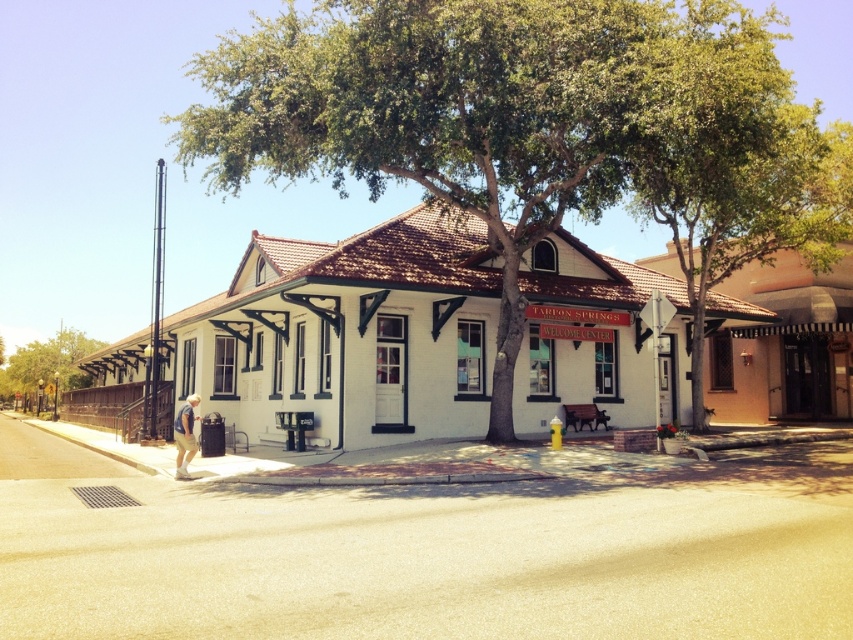
You are standing on the sidewalk in front of the historic building and notice both the green leafy tree at lower left and the white cotton shirt at lower left. Which object appears wider from your perspective?

The green leafy tree at lower left appears wider than the white cotton shirt at lower left because its width surpasses the shirt.

You are standing on the sidewalk in front of the historic building and notice both the green leafy tree at lower left and the white cotton shirt at lower left. Which object appears bigger in the scene?

The green leafy tree at lower left is larger in size compared to the white cotton shirt at lower left, so it appears bigger in the scene.

You are a visitor standing on the sidewalk in front of the historic building. You notice a green leafy tree at center and a white cotton shirt at lower left. Which object is taller?

The green leafy tree at center is taller than the white cotton shirt at lower left.